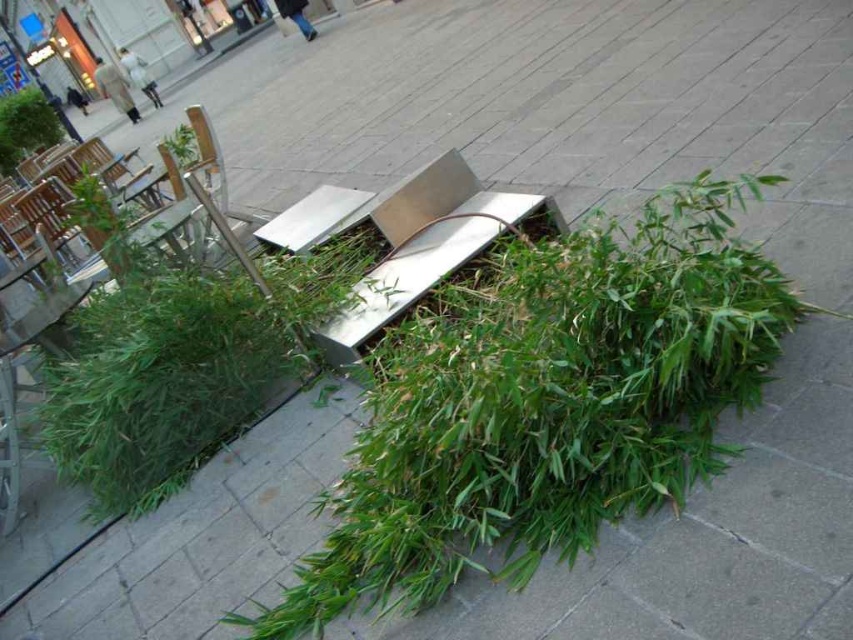
You are a city planner inspecting the area. You see the stainless steel bench at center and the green leafy plant at upper left. Which object is positioned higher in the scene?

The green leafy plant at upper left is higher in the scene than the stainless steel bench at center.

You are standing in the plaza and want to take a photo of the metal structure. You notice two points marked in the image at coordinates point (346, 330) and point (10, 134). Which point is closer to your camera lens when capturing the structure?

Point (346, 330) is closer to the camera lens than point (10, 134).

You are a maintenance worker in the plaza. You need to move the stainless steel bench at center and the green leafy plant at upper left to clear the walkway. According to their positions, which object should you move first to access the other?

The green leafy plant at upper left should be moved first because the stainless steel bench at center is to the right of it, so moving the plant first would allow access to the bench.